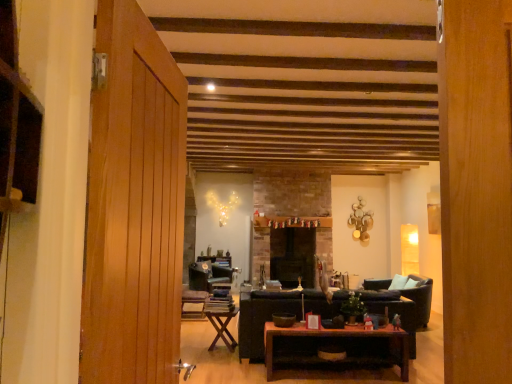
Question: Considering the relative sizes of wooden textured chair at center, the 1th chair viewed from the front, and leather armchair at right in the image provided, is wooden textured chair at center, the 1th chair viewed from the front, taller than leather armchair at right?

Choices:
 (A) yes
 (B) no

Answer: (B)

Question: Does wooden textured chair at center, the 1th chair viewed from the front, appear on the left side of leather armchair at right?

Choices:
 (A) yes
 (B) no

Answer: (A)

Question: Are wooden textured chair at center, the second chair when ordered from back to front, and leather armchair at right making contact?

Choices:
 (A) no
 (B) yes

Answer: (A)

Question: From the image's perspective, is wooden textured chair at center, the second chair when ordered from back to front, located above leather armchair at right?

Choices:
 (A) no
 (B) yes

Answer: (A)

Question: Can you confirm if wooden textured chair at center, the 1th chair viewed from the front, is bigger than leather armchair at right?

Choices:
 (A) yes
 (B) no

Answer: (B)

Question: Is wooden textured chair at center, the second chair when ordered from back to front, behind leather armchair at right?

Choices:
 (A) no
 (B) yes

Answer: (B)

Question: Does dark brown leather couch at center have a smaller size compared to wooden textured chair at center, the 1th chair viewed from the front?

Choices:
 (A) yes
 (B) no

Answer: (B)

Question: Would you say wooden textured chair at center, the second chair when ordered from back to front, is part of dark brown leather couch at center's contents?

Choices:
 (A) no
 (B) yes

Answer: (A)

Question: Is dark brown leather couch at center bigger than wooden textured chair at center, the 1th chair viewed from the front?

Choices:
 (A) yes
 (B) no

Answer: (A)

Question: From the image's perspective, is dark brown leather couch at center below wooden textured chair at center, the 1th chair viewed from the front?

Choices:
 (A) yes
 (B) no

Answer: (B)

Question: Is dark brown leather couch at center further to the viewer compared to wooden textured chair at center, the 1th chair viewed from the front?

Choices:
 (A) no
 (B) yes

Answer: (A)

Question: Is dark brown leather couch at center in front of wooden textured chair at center, the second chair when ordered from back to front?

Choices:
 (A) no
 (B) yes

Answer: (B)

Question: From a real-world perspective, does wooden door at left stand above black stone fireplace at center?

Choices:
 (A) yes
 (B) no

Answer: (A)